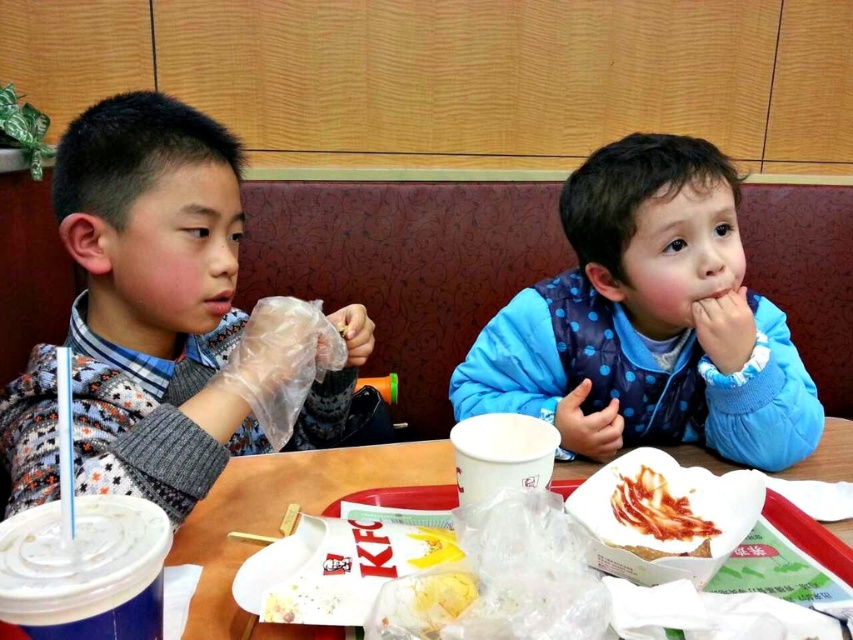
Question: Which object is the farthest from the patterned sweater at left?

Choices:
 (A) white paper cup at center
 (B) blue dotted vest at center

Answer: (B)

Question: Which point is closer to the camera taking this photo?

Choices:
 (A) (680, 438)
 (B) (422, 456)
 (C) (93, 451)

Answer: (C)

Question: Can you confirm if blue dotted vest at center is positioned to the left of shiny red bacon at center?

Choices:
 (A) no
 (B) yes

Answer: (A)

Question: Is blue dotted vest at center further to the viewer compared to white paper cup at center?

Choices:
 (A) no
 (B) yes

Answer: (B)

Question: Which object is closer to the camera taking this photo?

Choices:
 (A) blue dotted vest at center
 (B) patterned sweater at left
 (C) white paper cup at center

Answer: (C)

Question: Considering the relative positions of patterned sweater at left and blue dotted vest at center in the image provided, where is patterned sweater at left located with respect to blue dotted vest at center?

Choices:
 (A) below
 (B) above

Answer: (B)